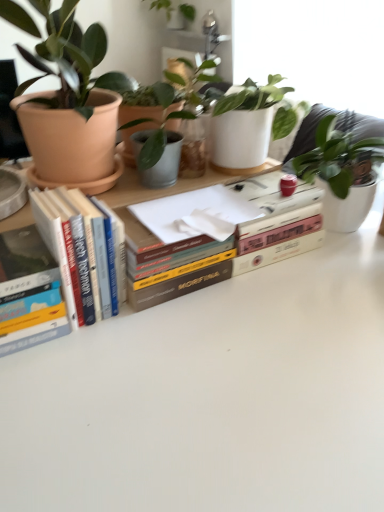
Find the location of a particular element. The width and height of the screenshot is (384, 512). free space above hardcover book at center, the third book in the left-to-right sequence (from a real-world perspective) is located at coordinates [216, 219].